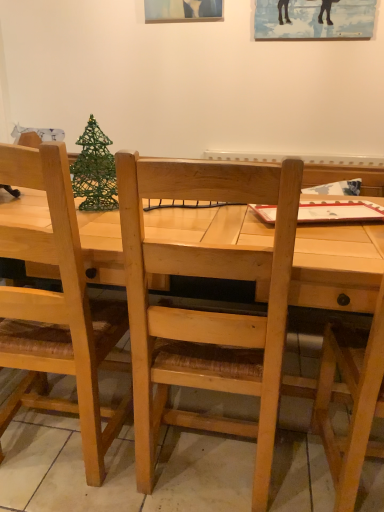
Question: Considering the positions of light wood table at center and wooden picture frame at upper center in the image, is light wood table at center taller or shorter than wooden picture frame at upper center?

Choices:
 (A) tall
 (B) short

Answer: (A)

Question: In terms of width, does light wood table at center look wider or thinner when compared to wooden picture frame at upper center?

Choices:
 (A) thin
 (B) wide

Answer: (B)

Question: Which of these objects is positioned farthest from the natural wood chair at left, which is the second chair from right to left?

Choices:
 (A) green wire christmas tree at upper left
 (B) light wood table at center
 (C) wooden picture frame at upper center
 (D) natural wood chair at right, placed as the 2th chair when sorted from left to right

Answer: (C)

Question: Based on their relative distances, which object is nearer to the light wood table at center?

Choices:
 (A) green wire christmas tree at upper left
 (B) natural wood chair at left, the 1th chair from the left
 (C) natural wood chair at right, which is the first chair from right to left
 (D) wooden picture frame at upper center

Answer: (C)